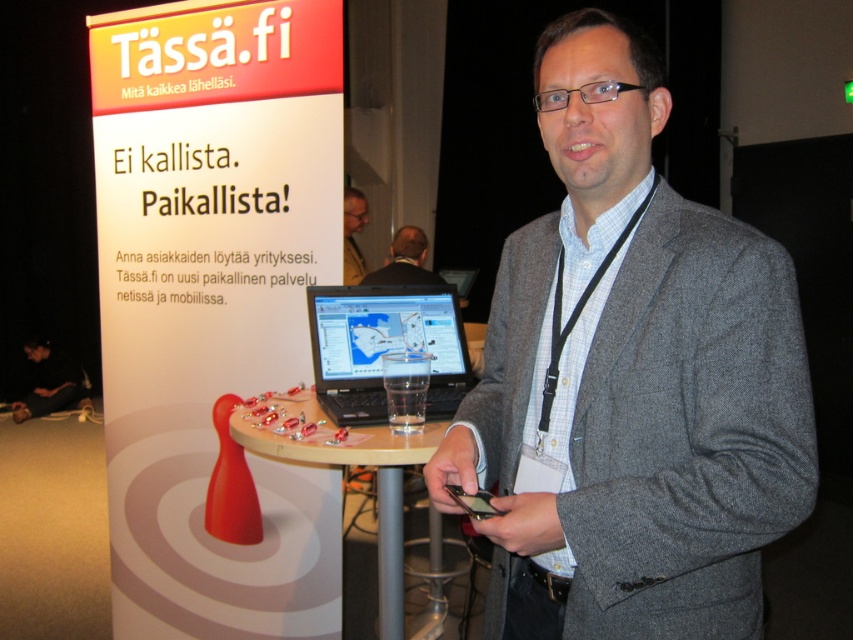
Question: Does black leather jacket at lower left appear on the right side of dark gray suit at center?

Choices:
 (A) yes
 (B) no

Answer: (B)

Question: Which of the following is the closest to the observer?

Choices:
 (A) click(350, 227)
 (B) click(396, 259)

Answer: (A)

Question: Is smooth wooden table at center bigger than glossy black laptop at center?

Choices:
 (A) yes
 (B) no

Answer: (A)

Question: Which object is closer to the camera taking this photo?

Choices:
 (A) black plastic laptop at center
 (B) gray woolen suit at center
 (C) dark gray suit at center
 (D) glossy black laptop at center

Answer: (B)

Question: Can you confirm if black plastic laptop at center is positioned above black leather jacket at lower left?

Choices:
 (A) yes
 (B) no

Answer: (A)

Question: Considering the real-world distances, which object is farthest from the gray woolen suit at center?

Choices:
 (A) smooth wooden table at center
 (B) dark gray suit at center
 (C) black leather jacket at lower left

Answer: (C)